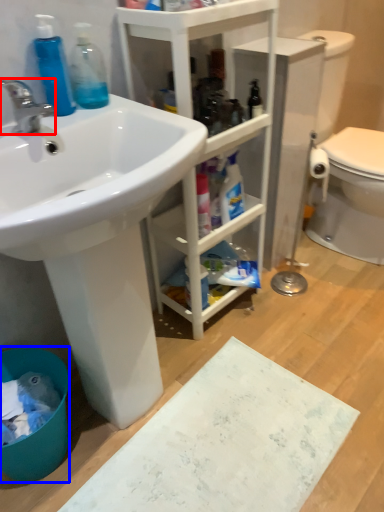
Question: Which object appears farthest to the camera in this image, tap (highlighted by a red box) or toilet bowl (highlighted by a blue box)?

Choices:
 (A) tap
 (B) toilet bowl

Answer: (B)